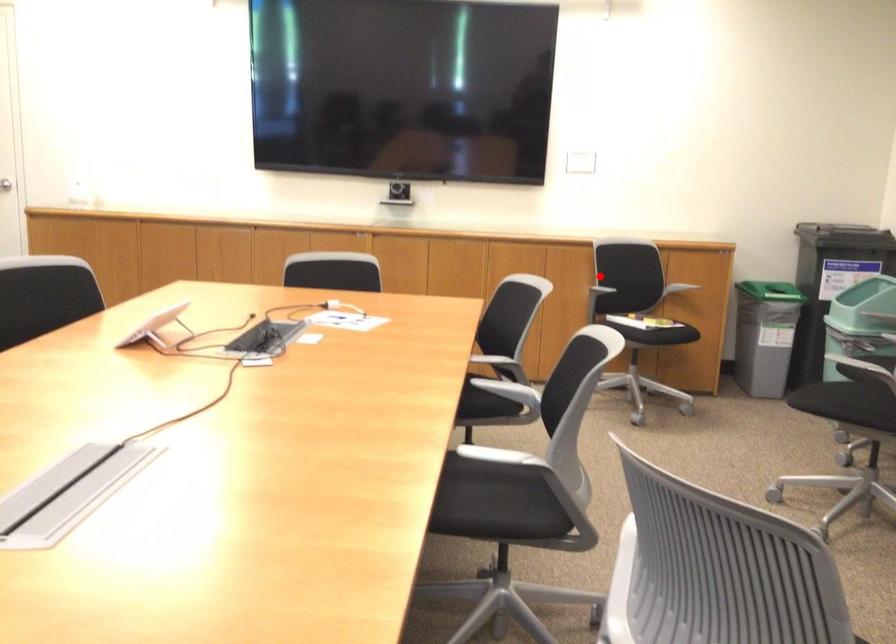
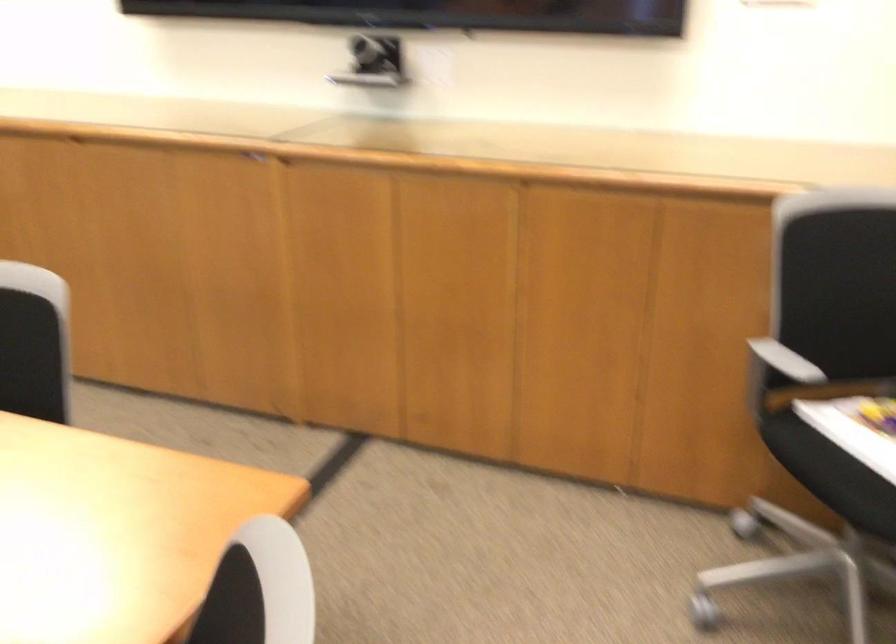
The point at the highlighted location is marked in the first image. Where is the corresponding point in the second image?

(778, 374)